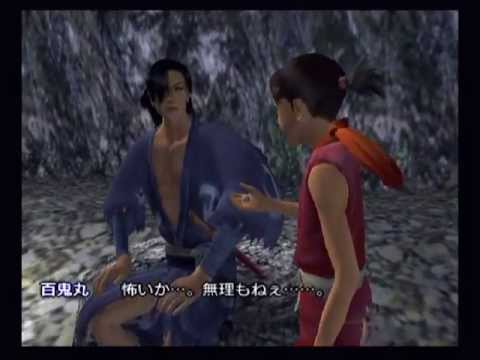
At what (x,y) coordinates should I click in order to perform the action: click on robe. Please return your answer as a coordinate pair (x, y). The image size is (480, 360). Looking at the image, I should click on (209, 164), (142, 172), (158, 270), (207, 313).